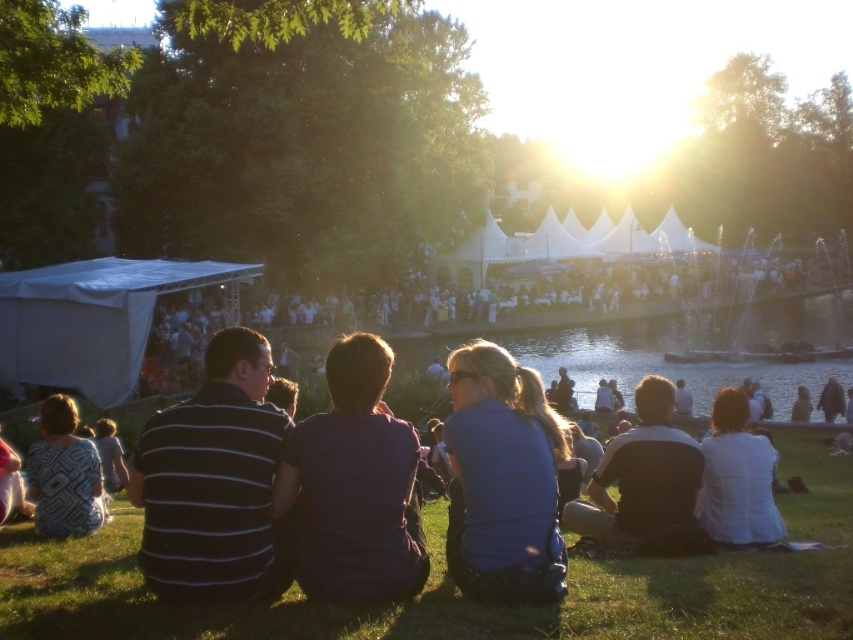
You are a photographer at the event and want to capture a photo that includes both the black striped shirt at center and the white matte shirt at lower right. Which shirt should you adjust your camera angle to focus on first if you want to ensure both are in frame?

The black striped shirt at center is shorter than the white matte shirt at lower right, so you should focus on the white matte shirt at lower right first to ensure both are in frame.

You are standing in the festival area and see the green grass at lower center and the blue matte shirt at center. Which object is positioned to the right when viewed from your perspective?

The green grass at lower center is positioned to the right of the blue matte shirt at center.